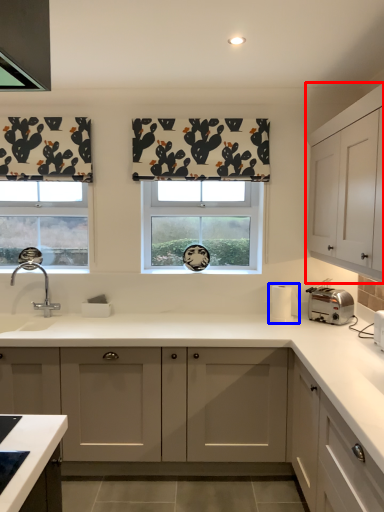
Question: Which point is closer to the camera, cabinetry (highlighted by a red box) or appliance (highlighted by a blue box)?

Choices:
 (A) cabinetry
 (B) appliance

Answer: (A)